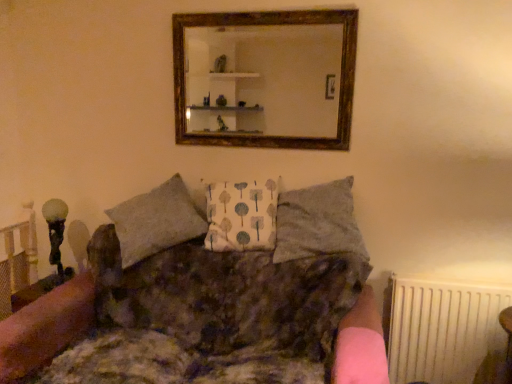
Question: Considering the positions of point (346, 228) and point (262, 317), is point (346, 228) closer or farther from the camera than point (262, 317)?

Choices:
 (A) farther
 (B) closer

Answer: (B)

Question: Based on their positions, is textured gray pillow at center, which is counted as the second pillow, starting from the left, located to the left or right of textured brown fabric couch at center?

Choices:
 (A) right
 (B) left

Answer: (A)

Question: Estimate the real-world distances between objects in this image. Which object is farther from the white fabric pillow at center, placed as the first pillow when sorted from left to right?

Choices:
 (A) wooden frame mirror at upper center
 (B) white plastic radiator at lower right
 (C) textured gray pillow at center, which is counted as the second pillow, starting from the left
 (D) textured brown fabric couch at center

Answer: (B)

Question: Based on their relative distances, which object is farther from the textured gray pillow at center, which is counted as the second pillow, starting from the left?

Choices:
 (A) white plastic radiator at lower right
 (B) textured brown fabric couch at center
 (C) white fabric pillow at center, placed as the first pillow when sorted from left to right
 (D) wooden frame mirror at upper center

Answer: (A)